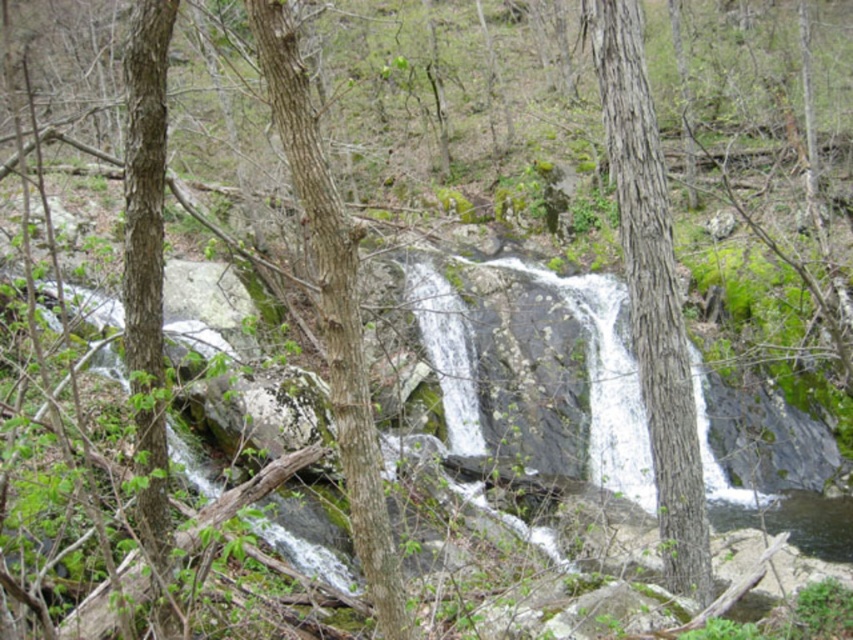
Question: Is brown rough bark tree at center bigger than smooth bark tree at left?

Choices:
 (A) yes
 (B) no

Answer: (A)

Question: Among these points, which one is farthest from the camera?

Choices:
 (A) (643, 189)
 (B) (376, 483)
 (C) (151, 301)

Answer: (A)

Question: Does smooth bark tree at center have a lesser width compared to smooth bark tree at left?

Choices:
 (A) yes
 (B) no

Answer: (A)

Question: Which point is closer to the camera taking this photo?

Choices:
 (A) (163, 129)
 (B) (380, 600)
 (C) (682, 464)

Answer: (B)

Question: Which of the following is the farthest from the observer?

Choices:
 (A) (689, 467)
 (B) (169, 589)
 (C) (409, 632)

Answer: (A)

Question: Is brown rough bark tree at center to the right of smooth bark tree at left from the viewer's perspective?

Choices:
 (A) no
 (B) yes

Answer: (B)